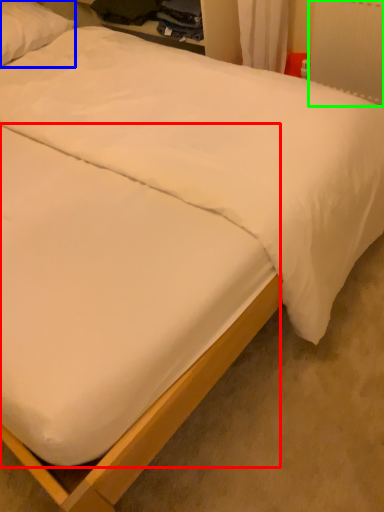
Question: Considering the real-world distances, which object is farthest from mattress (highlighted by a red box)? pillow (highlighted by a blue box) or radiator (highlighted by a green box)?

Choices:
 (A) pillow
 (B) radiator

Answer: (A)